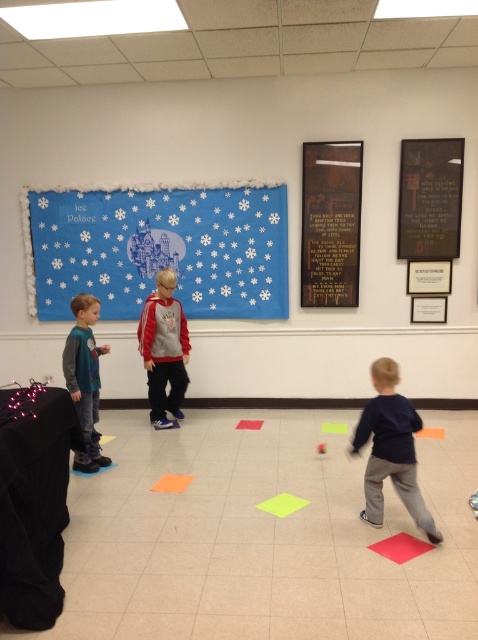
You are a teacher organizing materials in a classroom. You have an orange matte mat at center and a green paper at center. Which object is wider?

The orange matte mat at center is wider than the green paper at center according to the description provided.

You are a teacher trying to organize the classroom. You need to place the matte red hoodie at center on top of the orange matte mat at center. Will the hoodie fit on the mat without hanging over the edges?

The matte red hoodie at center might be wider than orange matte mat at center, so there is a possibility that the hoodie will hang over the edges of the mat.